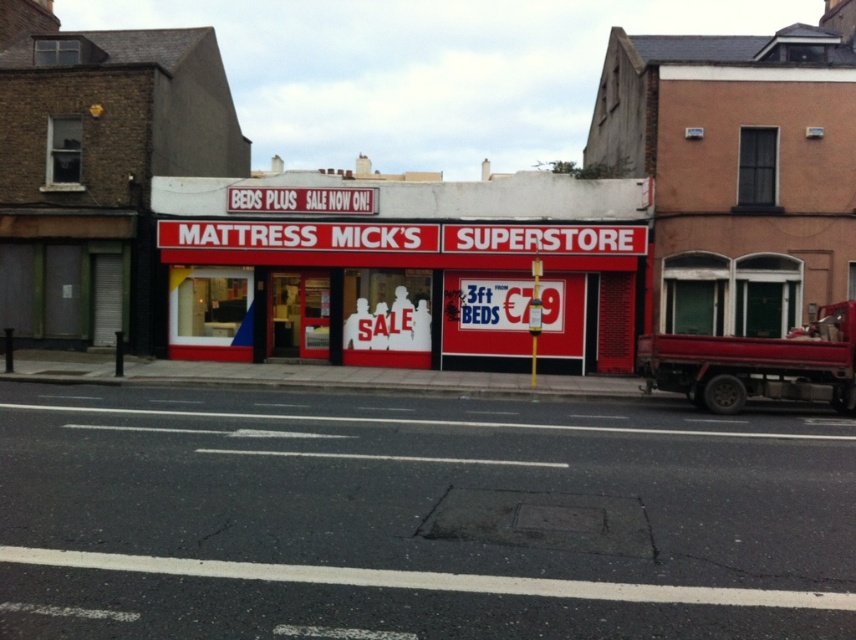
Question: Is red matte sign at center further to the viewer compared to metallic red truck at right?

Choices:
 (A) yes
 (B) no

Answer: (A)

Question: Is red matte sign at center positioned behind metallic red truck at right?

Choices:
 (A) yes
 (B) no

Answer: (A)

Question: Does red matte sign at center have a lesser width compared to metallic red truck at right?

Choices:
 (A) no
 (B) yes

Answer: (A)

Question: Among these objects, which one is nearest to the camera?

Choices:
 (A) metallic red truck at right
 (B) red matte sign at center

Answer: (A)

Question: Among these points, which one is farthest from the camera?

Choices:
 (A) (287, 200)
 (B) (635, 353)

Answer: (A)